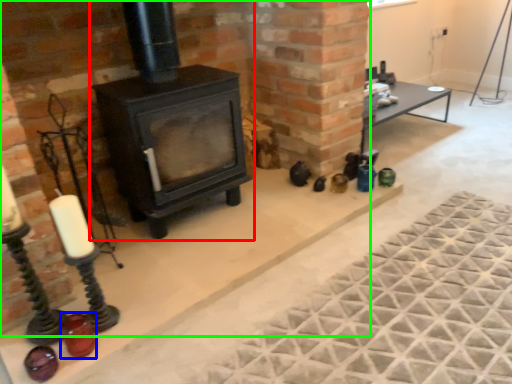
Question: Based on their relative distances, which object is farther from wood burning stove (highlighted by a red box)? Choose from candle holder (highlighted by a blue box) and fireplace (highlighted by a green box).

Choices:
 (A) candle holder
 (B) fireplace

Answer: (A)